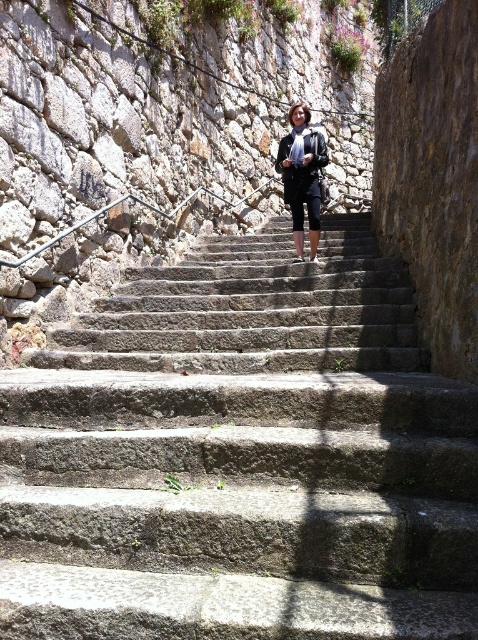
Consider the image. You are standing at the bottom of the gray stone stairs at center and see the black leather jacket at center lying nearby. If you want to pick up the jacket without moving from your current position, is it possible?

The gray stone stairs at center has a lesser height compared to the black leather jacket at center, so the stairs are shorter than the jacket. Since you are at the bottom of the stairs, the jacket is likely within reach if it is lying nearby at the same level. However, the height difference might make it difficult to reach unless you can extend your arm sufficiently.

You are standing at the base of the gray stone stairs at center. You want to take a photo of the stairs with your phone, which has a maximum focus range of 1.5 meters. Will the stairs be in focus?

The gray stone stairs at center is 1.62 meters away from camera, which is beyond the phone camera maximum focus range of 1.5 meters. So the stairs will not be in focus.

You are standing at the bottom of the gray stone stairs at center and see the black leather jacket at center. Which object is lower in position?

The gray stone stairs at center are located below the black leather jacket at center, so the stairs are lower than the jacket.